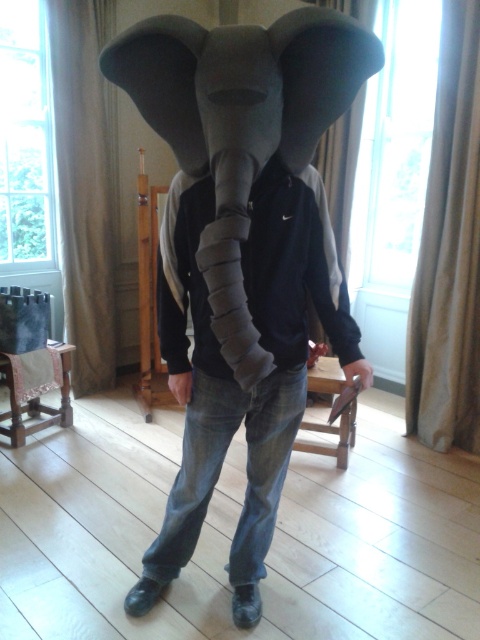
Which of these two, matte gray elephant head at center or felt elephant head at center, stands taller?

Standing taller between the two is matte gray elephant head at center.

Is matte gray elephant head at center closer to camera compared to felt elephant head at center?

No.

Is point (207, 387) positioned behind point (226, 180)?

That is True.

Where is `matte gray elephant head at center`? This screenshot has height=640, width=480. matte gray elephant head at center is located at coordinates (231, 371).